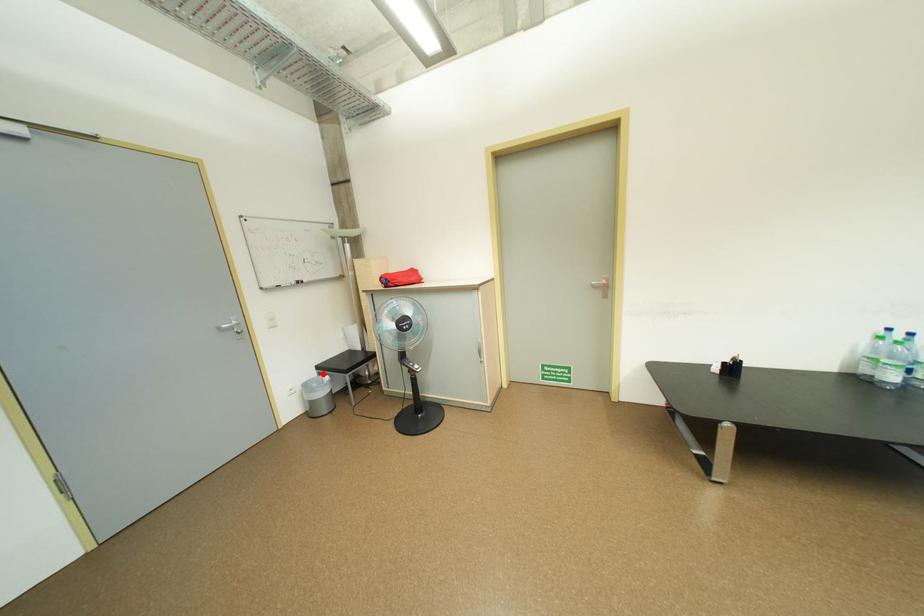
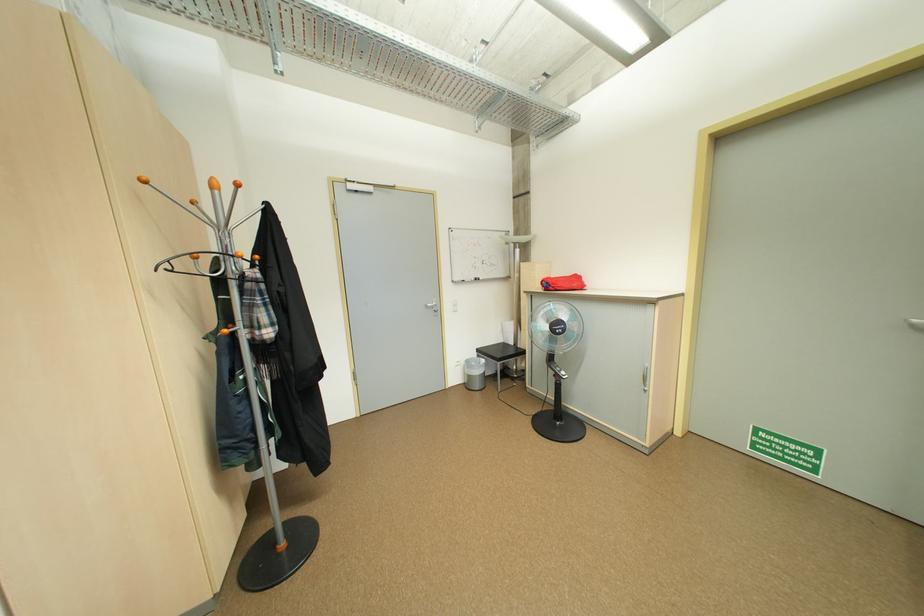
Question: I am providing you with two images of the same scene from different viewpoints. A red point is marked on the first image. At the location where the point appears in image 1, is it still visible in image 2?

Choices:
 (A) Yes
 (B) No

Answer: (A)